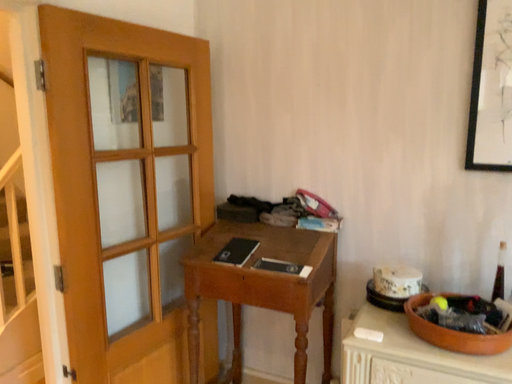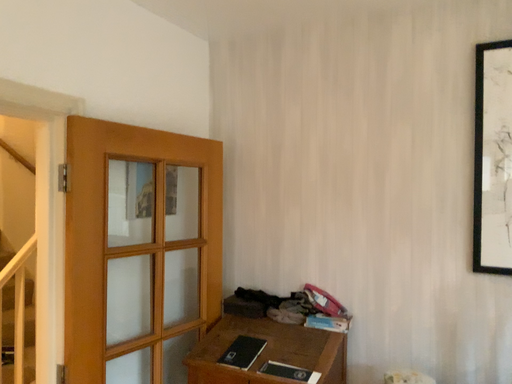
Question: How did the camera likely rotate when shooting the video?

Choices:
 (A) rotated downward
 (B) rotated upward

Answer: (B)